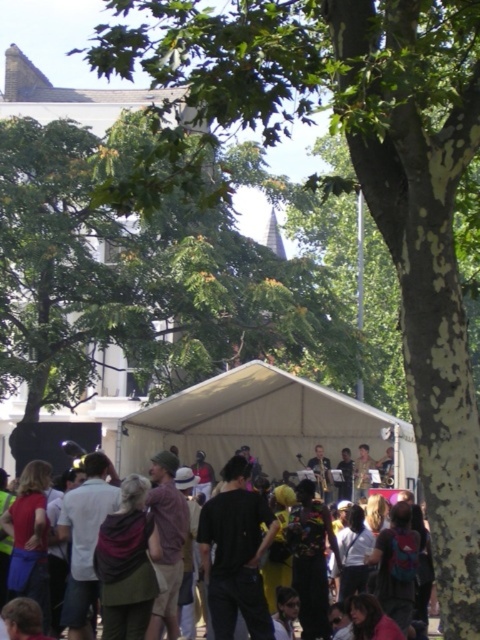
Does green leafy tree at upper center have a smaller size compared to black fabric tent at center?

No.

Is green leafy tree at upper center to the right of black fabric tent at center from the viewer's perspective?

Incorrect, green leafy tree at upper center is not on the right side of black fabric tent at center.

Between point (19, 148) and point (168, 461), which one is positioned behind?

The point (19, 148) is behind.

Identify the location of green leafy tree at upper center. (141, 280).

Is green leafy tree at upper center to the right of white fabric canopy at center from the viewer's perspective?

In fact, green leafy tree at upper center is to the left of white fabric canopy at center.

Is green leafy tree at upper center to the left of white fabric canopy at center from the viewer's perspective?

Correct, you'll find green leafy tree at upper center to the left of white fabric canopy at center.

At what (x,y) coordinates should I click in order to perform the action: click on green leafy tree at upper center. Please return your answer as a coordinate pair (x, y). This screenshot has height=640, width=480. Looking at the image, I should click on (141, 280).

Between white fabric canopy at center and black fabric tent at center, which one appears on the left side from the viewer's perspective?

black fabric tent at center is more to the left.

Measure the distance from white fabric canopy at center to black fabric tent at center.

white fabric canopy at center and black fabric tent at center are 37.13 feet apart from each other.

The image size is (480, 640). I want to click on white fabric canopy at center, so click(263, 422).